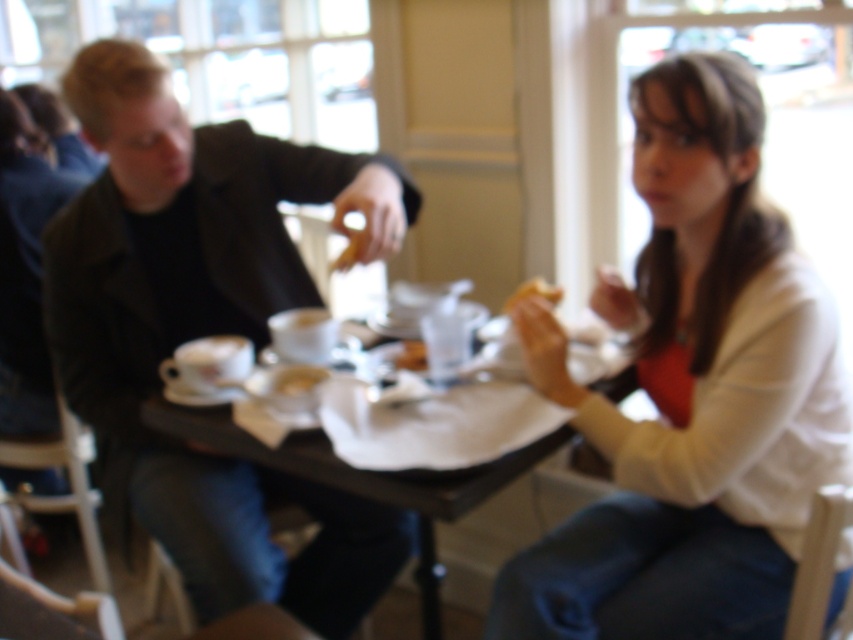
Question: Is matte white bread at center bigger than golden brown bread at center?

Choices:
 (A) no
 (B) yes

Answer: (B)

Question: Is dark gray coat at left thinner than matte white bread at center?

Choices:
 (A) yes
 (B) no

Answer: (B)

Question: Does white matte sweater at upper right appear under dark gray coat at left?

Choices:
 (A) no
 (B) yes

Answer: (A)

Question: Which of the following is the farthest from the observer?

Choices:
 (A) white matte sweater at upper right
 (B) dark gray coat at left
 (C) black plastic table at center

Answer: (B)

Question: Which object is the closest to the golden brown bread at center?

Choices:
 (A) black plastic table at center
 (B) dark gray coat at left
 (C) matte white bread at center

Answer: (C)

Question: Which object appears farthest from the camera in this image?

Choices:
 (A) white matte sweater at upper right
 (B) golden brown bread at center

Answer: (B)